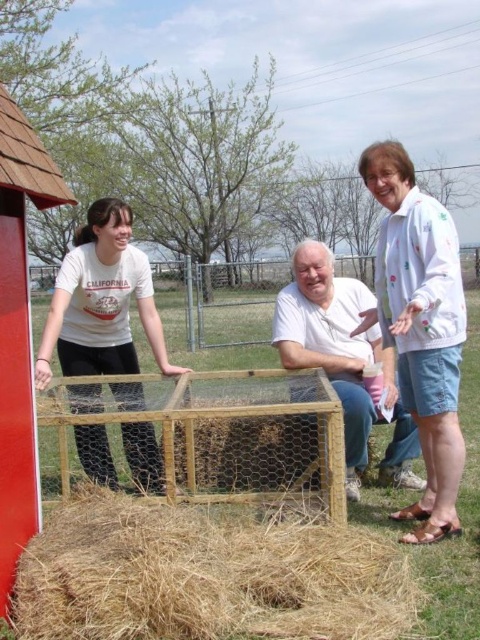
Question: From the image, what is the correct spatial relationship of brown straw at lower center in relation to white matte chicken wire at center?

Choices:
 (A) right
 (B) left

Answer: (B)

Question: Is the position of white dotted jacket at upper right less distant than that of matte white shirt at center?

Choices:
 (A) yes
 (B) no

Answer: (A)

Question: Which point is closer to the camera?

Choices:
 (A) matte white shirt at center
 (B) white matte chicken wire at center
 (C) brown straw at lower center

Answer: (C)

Question: Among these points, which one is farthest from the camera?

Choices:
 (A) click(103, 500)
 (B) click(123, 355)

Answer: (B)

Question: Does matte white shirt at center appear over white matte chicken wire at center?

Choices:
 (A) yes
 (B) no

Answer: (A)

Question: Among these objects, which one is farthest from the camera?

Choices:
 (A) white dotted jacket at upper right
 (B) brown straw at lower center
 (C) matte white shirt at center
 (D) white matte chicken wire at center

Answer: (D)